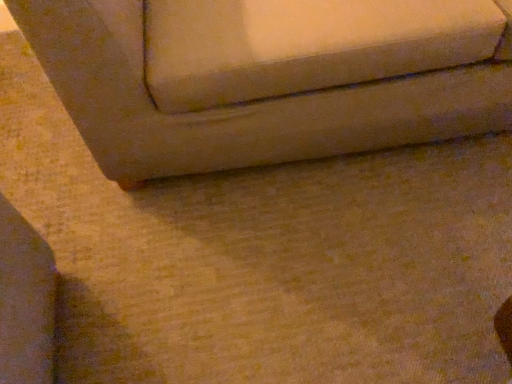
What do you see at coordinates (202, 112) in the screenshot? The image size is (512, 384). I see `beige fabric couch at lower left` at bounding box center [202, 112].

In order to click on beige fabric couch at lower left in this screenshot , I will do `click(202, 112)`.

Identify the location of beige fabric couch at lower left. [x=202, y=112].